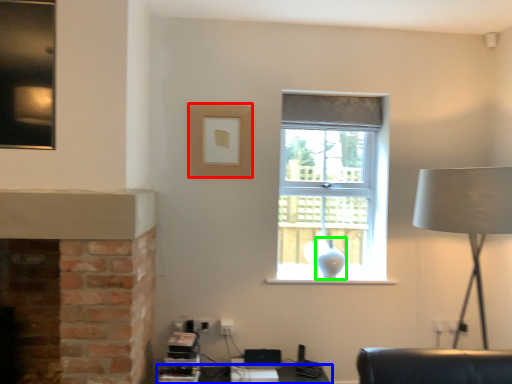
Question: Which object is positioned farthest from picture frame (highlighted by a red box)? Select from table (highlighted by a blue box) and glass vase (highlighted by a green box).

Choices:
 (A) table
 (B) glass vase

Answer: (A)